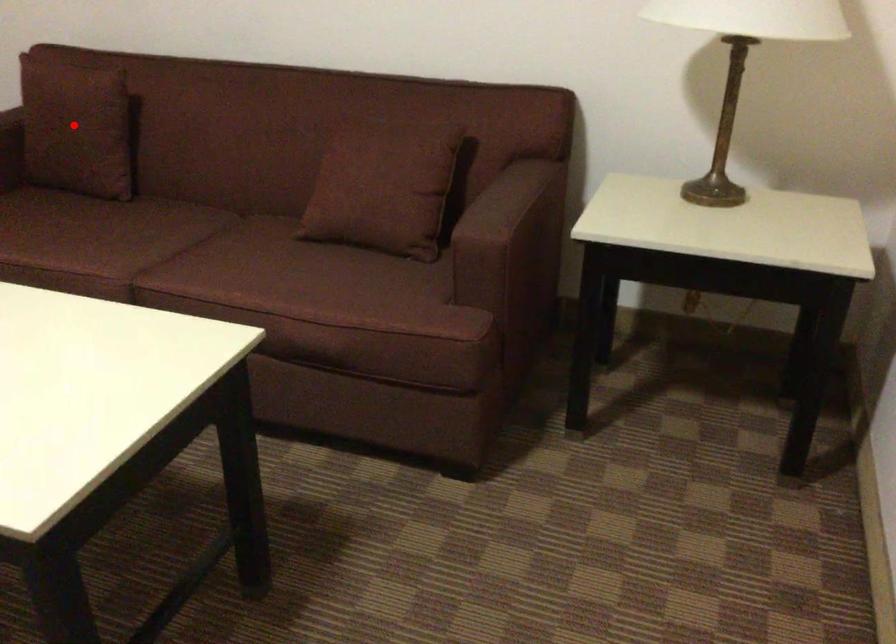
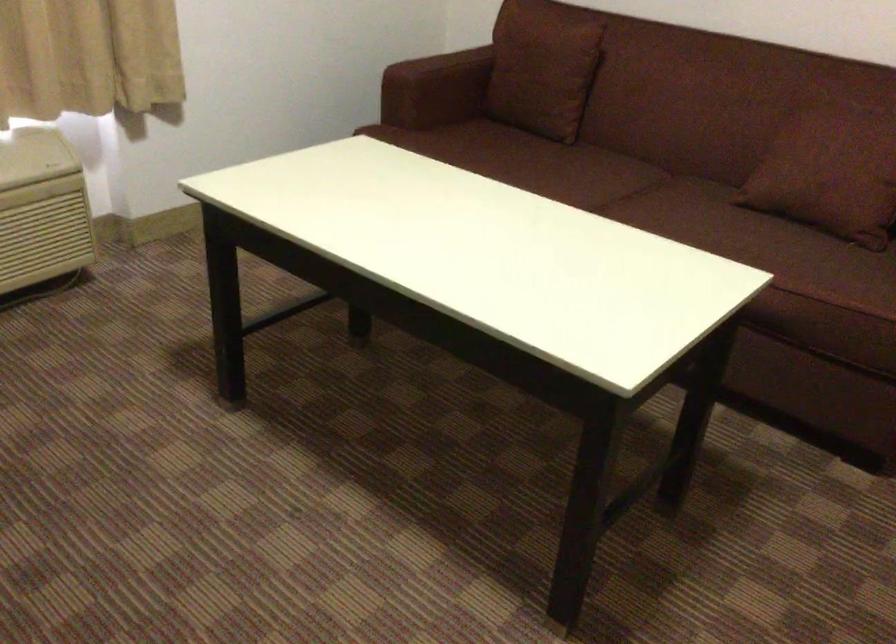
Question: I am providing you with two images of the same scene from different viewpoints. A red point is shown in image1. For the corresponding object point in image2, is it positioned nearer or farther from the camera?

Choices:
 (A) Nearer
 (B) Farther

Answer: (B)